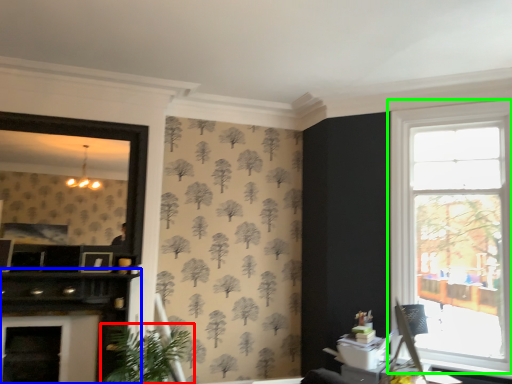
Question: Considering the real-world distances, which object is farthest from houseplant (highlighted by a red box)? dresser (highlighted by a blue box) or window (highlighted by a green box)?

Choices:
 (A) dresser
 (B) window

Answer: (B)